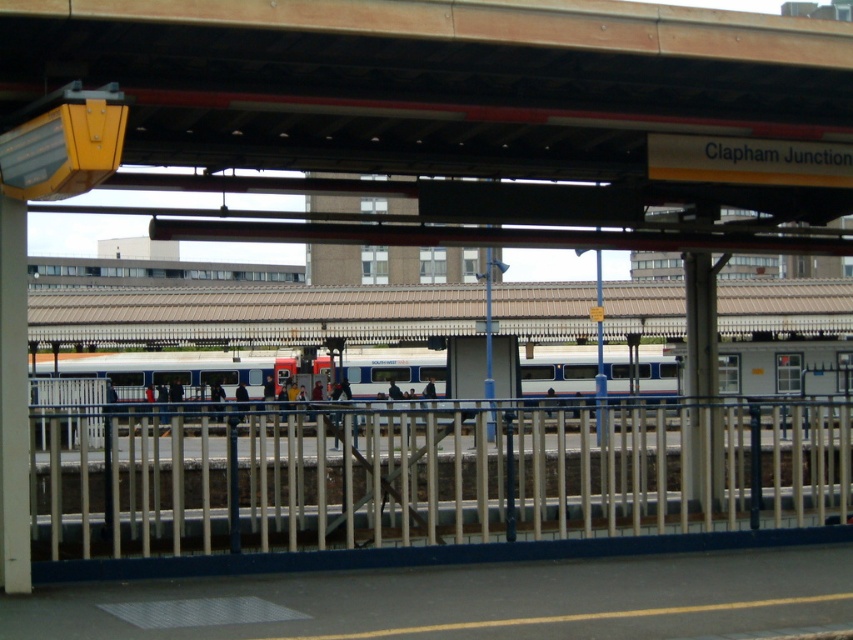
Between point (683, 19) and point (631, 444), which one is positioned behind?

Positioned behind is point (631, 444).

Can you confirm if wooden beam at upper center is positioned above metallic silver rail at center?

Yes.

Describe the element at coordinates (431, 80) in the screenshot. I see `wooden beam at upper center` at that location.

Identify the location of wooden beam at upper center. (431, 80).